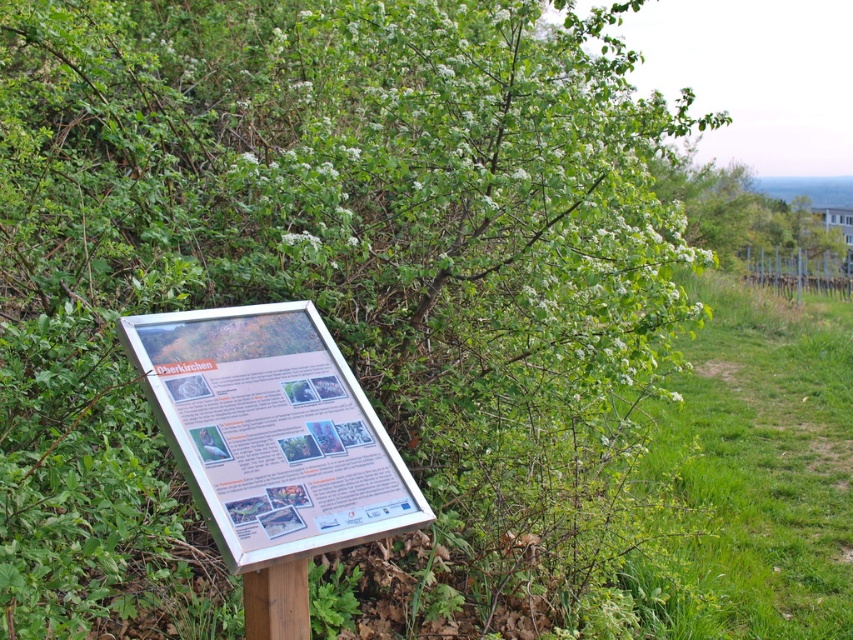
You are a hiker who wants to read the information on the white paper sign at center and the brown wooden pole at lower center. Which one is closer to you?

The white paper sign at center is in front of brown wooden pole at lower center, so it is closer to you.

You are standing at the origin point of the image coordinate system. You want to place a new sign exactly 0.1 units to the right of the white paper sign at center. What are the coordinates of the new sign?

The white paper sign at center is located at coordinates [271,432]. Adding 0.1 to the x coordinate gives 0.775, so the new coordinates are [271,496].

You are a hiker who wants to read the white paper sign at center mounted on the brown wooden pole at lower center. Can you see the entire sign without needing to climb the pole?

The white paper sign at center is taller than the brown wooden pole at lower center, so it is possible that the sign extends above the pole, making the entire sign visible without climbing.